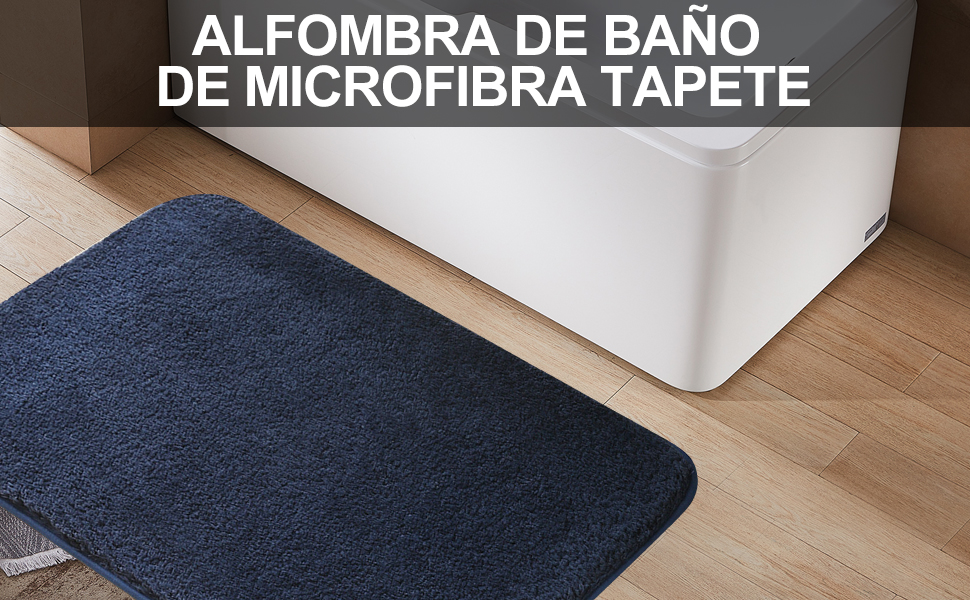
The width and height of the screenshot is (970, 600). Identify the location of upper right corner of mat. (692, 475).